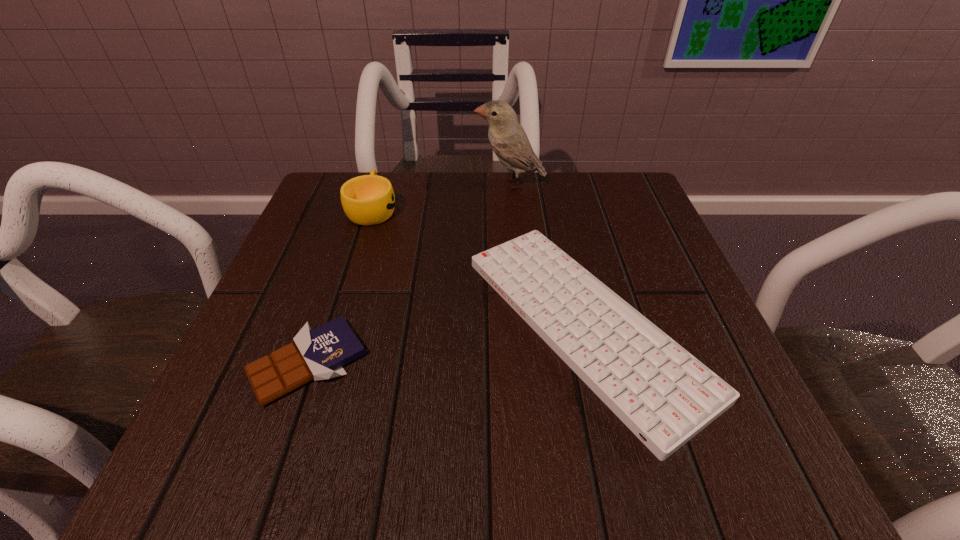
Where is `free spot between the third shortest object and the tallest object`? This screenshot has width=960, height=540. free spot between the third shortest object and the tallest object is located at coordinates (442, 197).

Identify the location of vacant point located between the tallest object and the chocolate bar. (409, 273).

Where is `free area in between the cup and the tallest object`? This screenshot has height=540, width=960. free area in between the cup and the tallest object is located at coordinates (442, 197).

Identify which object is the closest to the bird. Please provide its 2D coordinates. Your answer should be formatted as a tuple, i.e. [(x, y)], where the tuple contains the x and y coordinates of a point satisfying the conditions above.

[(367, 200)]

Identify which object is the second closest to the bird. Please provide its 2D coordinates. Your answer should be formatted as a tuple, i.e. [(x, y)], where the tuple contains the x and y coordinates of a point satisfying the conditions above.

[(663, 394)]

Find the location of a particular element. Image resolution: width=960 pixels, height=540 pixels. vacant region that satisfies the following two spatial constraints: 1. on the front side of the third shortest object; 2. on the left side of the computer keyboard is located at coordinates (337, 324).

Image resolution: width=960 pixels, height=540 pixels. In order to click on free location that satisfies the following two spatial constraints: 1. on the back side of the chocolate bar; 2. on the right side of the second tallest object in this screenshot , I will do `click(361, 210)`.

This screenshot has width=960, height=540. What are the coordinates of `free spot that satisfies the following two spatial constraints: 1. at the face of the computer keyboard; 2. on the left side of the bird` in the screenshot? It's located at (523, 324).

This screenshot has height=540, width=960. In order to click on blank area in the image that satisfies the following two spatial constraints: 1. at the face of the computer keyboard; 2. on the right side of the bird in this screenshot , I will do `click(523, 324)`.

This screenshot has width=960, height=540. Find the location of `blank space that satisfies the following two spatial constraints: 1. at the face of the computer keyboard; 2. on the left side of the bird`. blank space that satisfies the following two spatial constraints: 1. at the face of the computer keyboard; 2. on the left side of the bird is located at coordinates (523, 324).